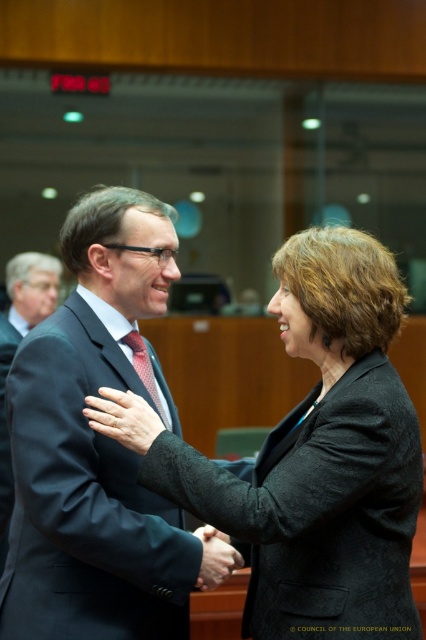
Looking at this image, you are an event planner observing a formal event. You notice two key elements in the scene described above. The matte black suit at center and the matte red tie at center. Based on their positions, which one is closer to the front of the scene?

The matte black suit at center is closer to the front of the scene because it is positioned in front of the matte red tie at center.

You are an event planner organizing a photoshoot for a formal event. You need to ensure that the dark gray wool suit at left and the matte red tie at center are positioned such that they do not overlap in the frame. Based on their sizes, can you confirm if this arrangement is feasible?

The dark gray wool suit at left might be wider than matte red tie at center, so there is a possibility that they could overlap if placed too close. To avoid overlap, ensure sufficient spacing between them.